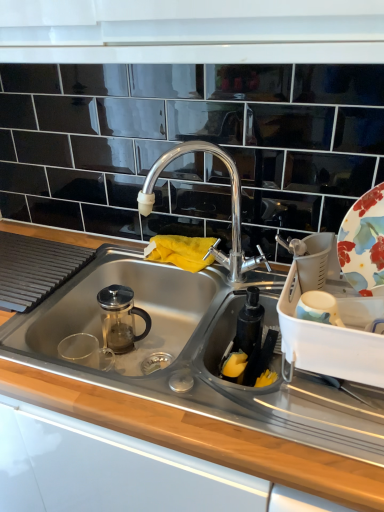
Describe the element at coordinates (363, 242) in the screenshot. I see `floral ceramic platter at right` at that location.

This screenshot has width=384, height=512. I want to click on polished chrome faucet at center, so click(231, 204).

I want to click on floral ceramic platter at right, so click(x=363, y=242).

Is polished chrome faucet at center bigger or smaller than stainless steel sink at center?

Clearly, polished chrome faucet at center is smaller in size than stainless steel sink at center.

Which point is more forward, (x=260, y=255) or (x=215, y=359)?

The point (x=215, y=359) is closer to the camera.

Is polished chrome faucet at center next to stainless steel sink at center?

No, polished chrome faucet at center is not touching stainless steel sink at center.

Locate an element on the screen. This screenshot has width=384, height=512. tap above the stainless steel sink at center (from the image's perspective) is located at coordinates (231, 204).

Would you say floral ceramic platter at right is part of polished chrome faucet at center's contents?

No.

Is point (222, 260) farther from camera compared to point (361, 217)?

Yes, it is.

From their relative heights in the image, would you say polished chrome faucet at center is taller or shorter than floral ceramic platter at right?

Considering their sizes, polished chrome faucet at center has more height than floral ceramic platter at right.

Between stainless steel sink at center and floral ceramic platter at right, which one has less height?

stainless steel sink at center.

Considering the relative positions of stainless steel sink at center and floral ceramic platter at right in the image provided, is stainless steel sink at center behind floral ceramic platter at right?

That is True.

From the picture: How many degrees apart are the facing directions of stainless steel sink at center and floral ceramic platter at right?

The angle between the facing direction of stainless steel sink at center and the facing direction of floral ceramic platter at right is 0.267 degrees.

Is stainless steel sink at center facing away from floral ceramic platter at right?

No, stainless steel sink at center is not facing the opposite direction of floral ceramic platter at right.

Are floral ceramic platter at right and stainless steel sink at center making contact?

No, floral ceramic platter at right is not beside stainless steel sink at center.

Between floral ceramic platter at right and stainless steel sink at center, which one has smaller width?

Thinner between the two is floral ceramic platter at right.

Considering the sizes of floral ceramic platter at right and stainless steel sink at center in the image, is floral ceramic platter at right taller or shorter than stainless steel sink at center?

In the image, floral ceramic platter at right appears to be taller than stainless steel sink at center.

Is floral ceramic platter at right in front of stainless steel sink at center?

Yes, the depth of floral ceramic platter at right is less than that of stainless steel sink at center.

Considering the relative sizes of stainless steel sink at center and polished chrome faucet at center in the image provided, is stainless steel sink at center taller than polished chrome faucet at center?

No.

Which of these two, stainless steel sink at center or polished chrome faucet at center, is smaller?

polished chrome faucet at center.

Is stainless steel sink at center located outside polished chrome faucet at center?

Yes.

Is floral ceramic platter at right to the right of polished chrome faucet at center from the viewer's perspective?

Correct, you'll find floral ceramic platter at right to the right of polished chrome faucet at center.

Is floral ceramic platter at right facing away from polished chrome faucet at center?

No, floral ceramic platter at right is not facing the opposite direction of polished chrome faucet at center.

At what (x,y) coordinates should I click in order to perform the action: click on platter lying below the polished chrome faucet at center (from the image's perspective). Please return your answer as a coordinate pair (x, y). The image size is (384, 512). Looking at the image, I should click on (363, 242).

Where is `sink located on the left of polished chrome faucet at center`? sink located on the left of polished chrome faucet at center is located at coordinates (146, 311).

The width and height of the screenshot is (384, 512). What are the coordinates of `platter on the right of polished chrome faucet at center` in the screenshot? It's located at (363, 242).

Estimate the real-world distances between objects in this image. Which object is further from floral ceramic platter at right, polished chrome faucet at center or stainless steel sink at center?

Among the two, stainless steel sink at center is located further to floral ceramic platter at right.

From the image, which object appears to be nearer to polished chrome faucet at center, stainless steel sink at center or floral ceramic platter at right?

The object closer to polished chrome faucet at center is stainless steel sink at center.

Estimate the real-world distances between objects in this image. Which object is further from stainless steel sink at center, floral ceramic platter at right or polished chrome faucet at center?

Among the two, floral ceramic platter at right is located further to stainless steel sink at center.

Based on their spatial positions, is floral ceramic platter at right or stainless steel sink at center closer to polished chrome faucet at center?

stainless steel sink at center is positioned closer to the anchor polished chrome faucet at center.

When comparing their distances from floral ceramic platter at right, does stainless steel sink at center or polished chrome faucet at center seem closer?

polished chrome faucet at center lies closer to floral ceramic platter at right than the other object.

When comparing their distances from stainless steel sink at center, does polished chrome faucet at center or floral ceramic platter at right seem closer?

Among the two, polished chrome faucet at center is located nearer to stainless steel sink at center.

In order to click on tap located between stainless steel sink at center and floral ceramic platter at right in the left-right direction in this screenshot , I will do `click(231, 204)`.